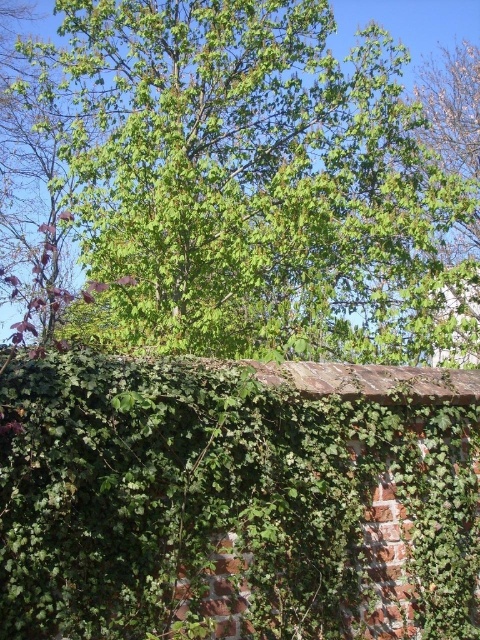
Based on the photo, is green leafy tree at upper center taller than green leafy hedge at upper center?

Correct, green leafy tree at upper center is much taller as green leafy hedge at upper center.

Does green leafy tree at upper center have a lesser height compared to green leafy hedge at upper center?

Incorrect, green leafy tree at upper center's height does not fall short of green leafy hedge at upper center's.

What do you see at coordinates (245, 180) in the screenshot?
I see `green leafy tree at upper center` at bounding box center [245, 180].

You are a GUI agent. You are given a task and a screenshot of the screen. Output one action in this format:
    pyautogui.click(x=<x>, y=<y>)
    Task: Click on the green leafy tree at upper center
    This screenshot has height=640, width=480.
    Given the screenshot: What is the action you would take?
    pyautogui.click(x=245, y=180)